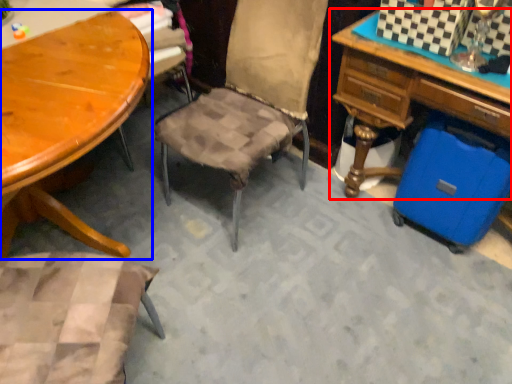
Question: Which point is closer to the camera, desk (highlighted by a red box) or table (highlighted by a blue box)?

Choices:
 (A) desk
 (B) table

Answer: (B)